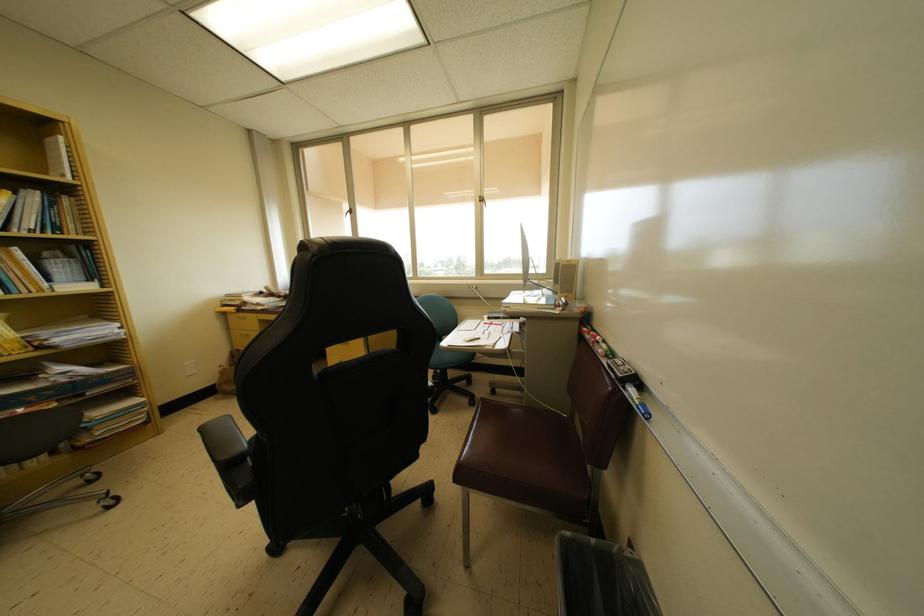
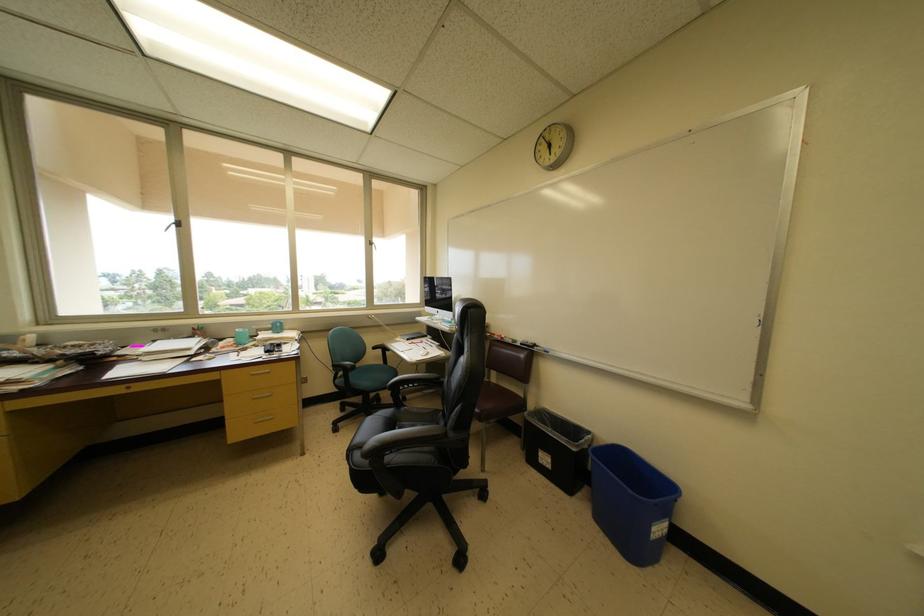
Where in the second image is the point corresponding to (639,385) from the first image?

(539, 350)